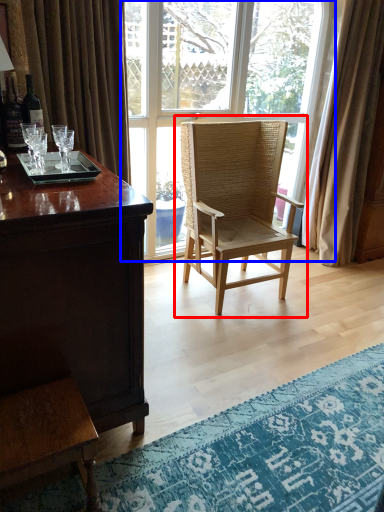
Question: Which of the following is the closest to the observer, chair (highlighted by a red box) or window (highlighted by a blue box)?

Choices:
 (A) chair
 (B) window

Answer: (A)